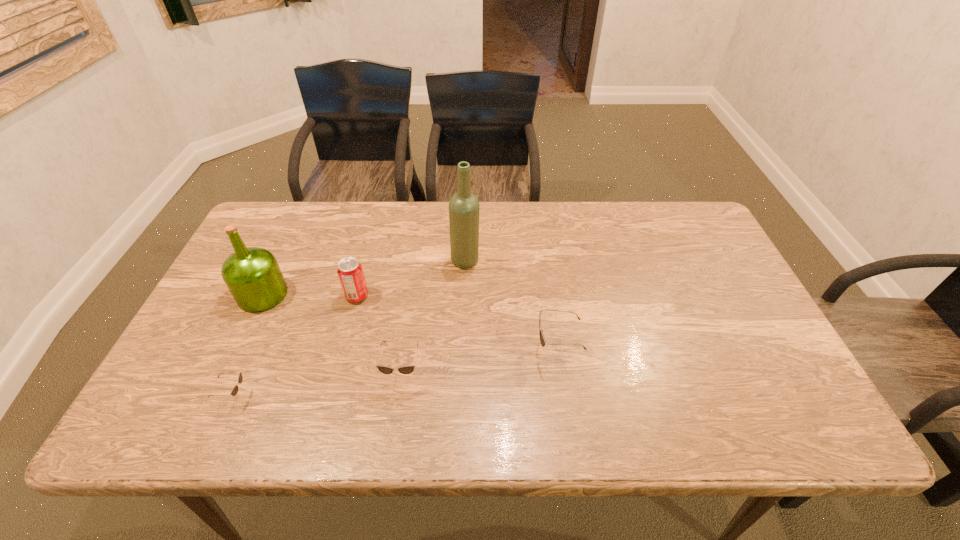
This screenshot has height=540, width=960. Identify the location of free region located 0.200m in front of the lenses of the rightmost sunglasses. (451, 350).

At what (x,y) coordinates should I click in order to perform the action: click on vacant space located 0.090m in front of the lenses of the rightmost sunglasses. Please return your answer as a coordinate pair (x, y). Looking at the image, I should click on coord(497,350).

Where is `vacant space positioned in front of the lenses of the rightmost sunglasses`? Image resolution: width=960 pixels, height=540 pixels. vacant space positioned in front of the lenses of the rightmost sunglasses is located at coordinates (447, 350).

Find the location of a particular element. This screenshot has height=540, width=960. vacant region located 0.300m on the left of the soda is located at coordinates (235, 296).

Where is `free location located on the back of the second tallest object`? Image resolution: width=960 pixels, height=540 pixels. free location located on the back of the second tallest object is located at coordinates (295, 227).

The width and height of the screenshot is (960, 540). Identify the location of vacant area located 0.400m on the left of the wine bottle. (315, 261).

Where is `sunglasses that is positioned at the left edge`? sunglasses that is positioned at the left edge is located at coordinates (234, 391).

This screenshot has width=960, height=540. I want to click on olive oil that is at the left edge, so click(252, 275).

Where is `object present at the near left corner`? The height and width of the screenshot is (540, 960). object present at the near left corner is located at coordinates [x=234, y=391].

Identify the location of free space at the far edge of the desktop. (406, 219).